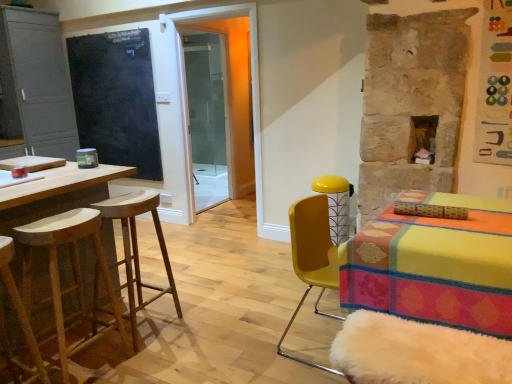
Image resolution: width=512 pixels, height=384 pixels. I want to click on free spot to the left of yellow matte chair at right, so click(250, 342).